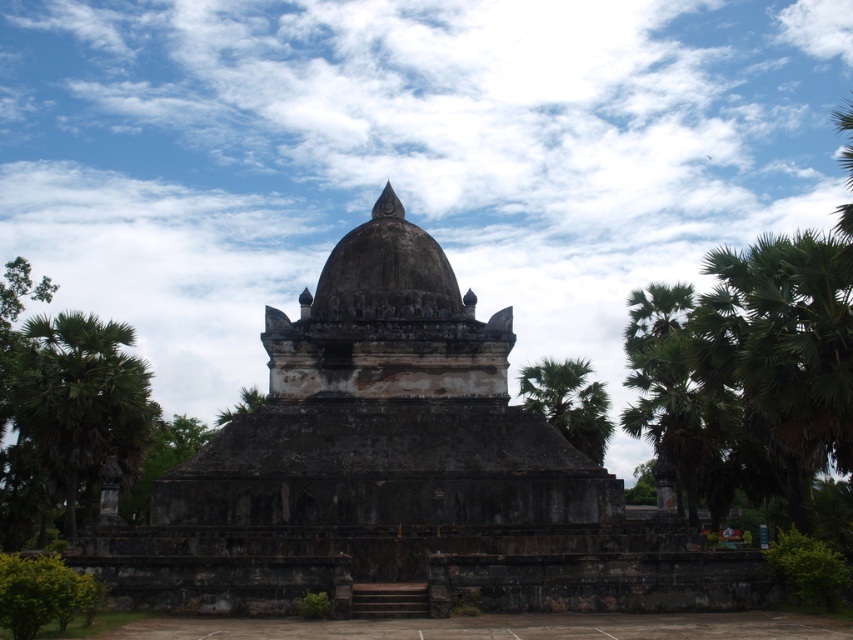
Is green leafy palm tree at left shorter than green leafy palm tree at right?

No.

Is point (76, 332) farther from camera compared to point (556, 369)?

That is False.

Which is in front, point (73, 326) or point (561, 433)?

Positioned in front is point (73, 326).

Where is `green leafy palm tree at left`? Image resolution: width=853 pixels, height=640 pixels. green leafy palm tree at left is located at coordinates (80, 403).

Between dark stone temple at center and green leafy palm tree at right, which one is positioned lower?

green leafy palm tree at right

In the scene shown: Can you confirm if dark stone temple at center is thinner than green leafy palm tree at right?

No, dark stone temple at center is not thinner than green leafy palm tree at right.

Is point (291, 499) closer to camera compared to point (585, 401)?

Yes, it is in front of point (585, 401).

This screenshot has height=640, width=853. Find the location of `dark stone temple at center`. dark stone temple at center is located at coordinates (399, 472).

Can you confirm if dark stone temple at center is shorter than green leafy palm tree at left?

No.

Can you confirm if dark stone temple at center is positioned to the left of green leafy palm tree at left?

No, dark stone temple at center is not to the left of green leafy palm tree at left.

You are a GUI agent. You are given a task and a screenshot of the screen. Output one action in this format:
    pyautogui.click(x=<x>, y=<y>)
    Task: Click on the dark stone temple at center
    The width and height of the screenshot is (853, 640).
    Given the screenshot: What is the action you would take?
    pyautogui.click(x=399, y=472)

Locate an element on the screen. dark stone temple at center is located at coordinates (399, 472).